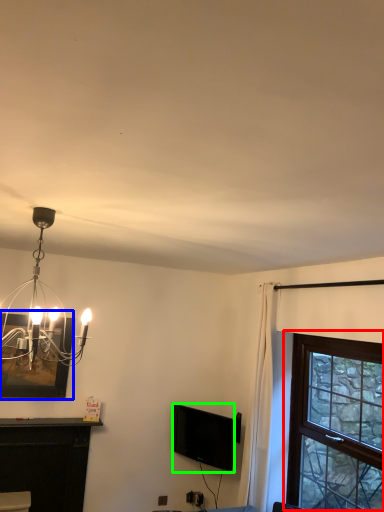
Question: Which is farther away from window (highlighted by a red box)? picture frame (highlighted by a blue box) or television (highlighted by a green box)?

Choices:
 (A) picture frame
 (B) television

Answer: (A)